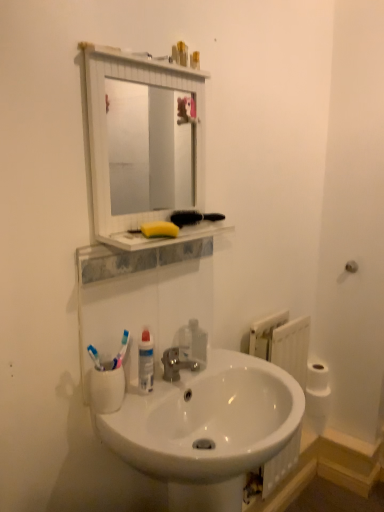
Question: Can we say white matte toilet paper at right lies outside white glossy sink at center?

Choices:
 (A) no
 (B) yes

Answer: (B)

Question: Can you confirm if white matte toilet paper at right is wider than white glossy sink at center?

Choices:
 (A) no
 (B) yes

Answer: (A)

Question: Considering the relative sizes of white matte toilet paper at right and white glossy sink at center in the image provided, is white matte toilet paper at right taller than white glossy sink at center?

Choices:
 (A) yes
 (B) no

Answer: (B)

Question: Considering the relative sizes of white matte toilet paper at right and white glossy sink at center in the image provided, is white matte toilet paper at right shorter than white glossy sink at center?

Choices:
 (A) yes
 (B) no

Answer: (A)

Question: Is the depth of white matte toilet paper at right greater than that of white glossy sink at center?

Choices:
 (A) no
 (B) yes

Answer: (B)

Question: From the image's perspective, is yellow sponge at upper center positioned above or below yellow sponge at upper center?

Choices:
 (A) below
 (B) above

Answer: (A)

Question: In terms of height, does yellow sponge at upper center look taller or shorter compared to yellow sponge at upper center?

Choices:
 (A) tall
 (B) short

Answer: (B)

Question: From a real-world perspective, is yellow sponge at upper center physically located above or below yellow sponge at upper center?

Choices:
 (A) above
 (B) below

Answer: (B)

Question: Considering their positions, is yellow sponge at upper center located in front of or behind yellow sponge at upper center?

Choices:
 (A) front
 (B) behind

Answer: (A)

Question: Is white glossy sink at center wider or thinner than yellow sponge at upper center?

Choices:
 (A) wide
 (B) thin

Answer: (A)

Question: Looking at the image, does white glossy sink at center seem bigger or smaller compared to yellow sponge at upper center?

Choices:
 (A) big
 (B) small

Answer: (A)

Question: Is white glossy sink at center taller or shorter than yellow sponge at upper center?

Choices:
 (A) short
 (B) tall

Answer: (B)

Question: From a real-world perspective, is white glossy sink at center above or below yellow sponge at upper center?

Choices:
 (A) above
 (B) below

Answer: (B)

Question: Is white plastic radiator at lower right wider or thinner than white matte toilet paper at right?

Choices:
 (A) wide
 (B) thin

Answer: (A)

Question: From the image's perspective, relative to white matte toilet paper at right, is white plastic radiator at lower right above or below?

Choices:
 (A) below
 (B) above

Answer: (B)